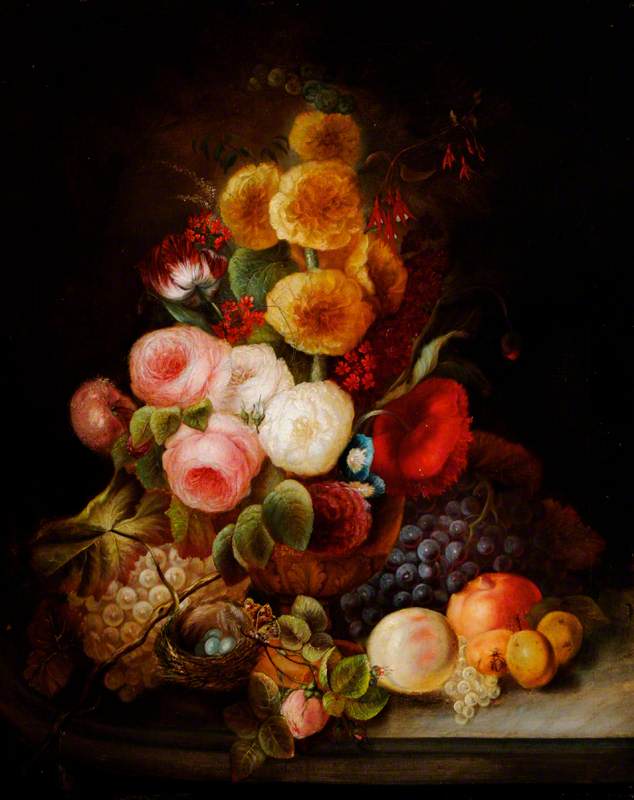
Identify the location of orange flowers. (321, 305), (383, 276), (320, 197), (252, 202), (331, 138).